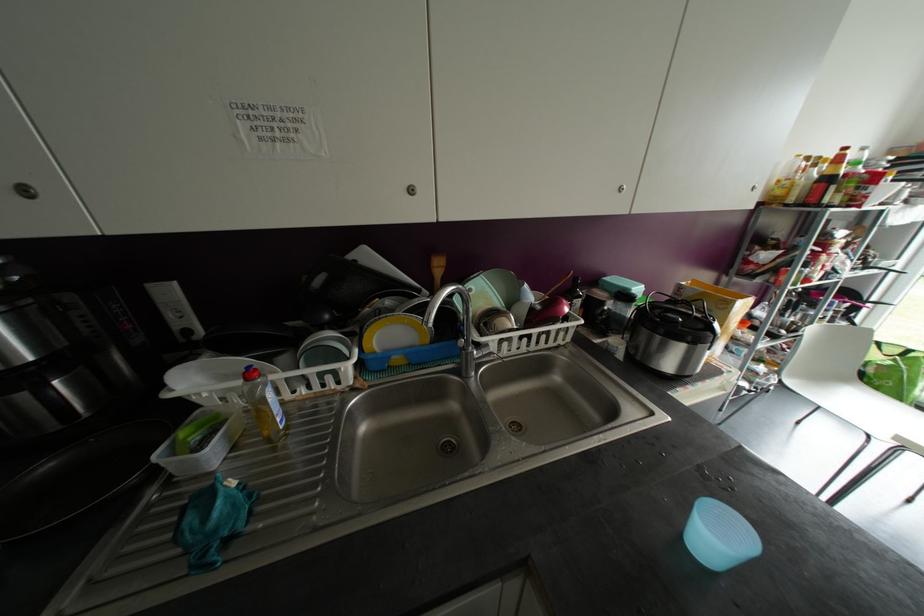
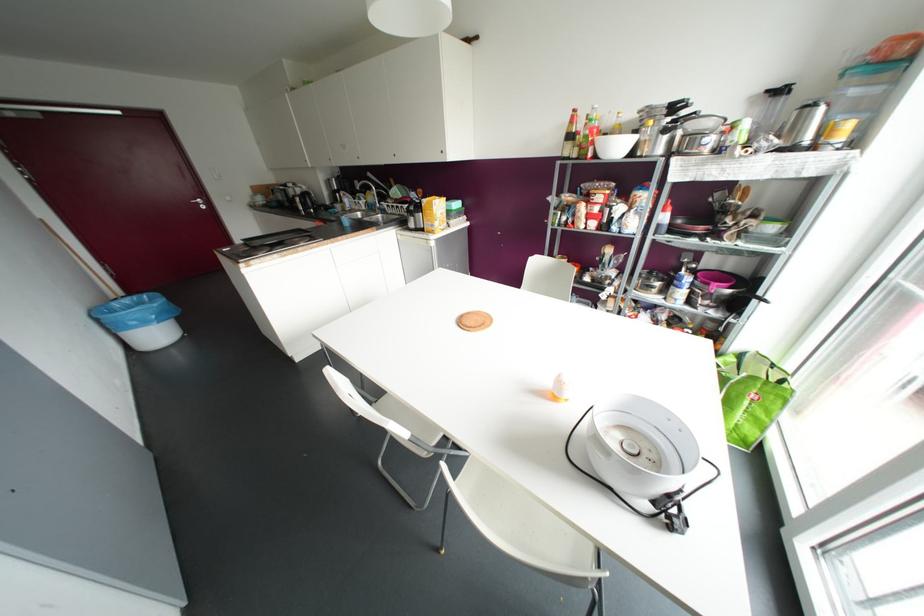
Find the pixel in the second image that matches (845,148) in the first image.

(574, 110)